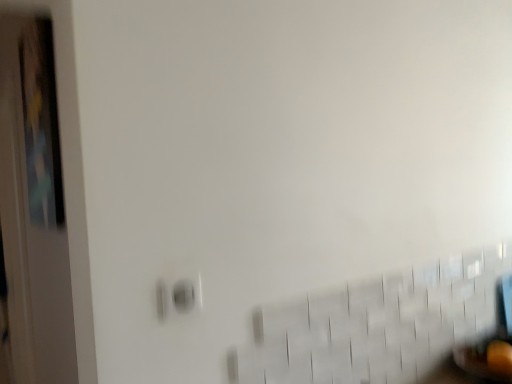
What do you see at coordinates (33, 211) in the screenshot? I see `wooden door at left` at bounding box center [33, 211].

Find the location of `wooden door at left`. wooden door at left is located at coordinates (33, 211).

The width and height of the screenshot is (512, 384). What do you see at coordinates (178, 297) in the screenshot?
I see `matte white electric outlet at lower left` at bounding box center [178, 297].

Where is `matte white electric outlet at lower left`? The image size is (512, 384). matte white electric outlet at lower left is located at coordinates (178, 297).

Locate an element on the screen. The width and height of the screenshot is (512, 384). wooden door at left is located at coordinates (33, 211).

Considering the positions of objects matte white electric outlet at lower left and wooden door at left in the image provided, who is more to the left, matte white electric outlet at lower left or wooden door at left?

wooden door at left is more to the left.

Considering their positions, is matte white electric outlet at lower left located in front of or behind wooden door at left?

In the image, matte white electric outlet at lower left appears in front of wooden door at left.

Considering the positions of points (161, 280) and (16, 366), is point (161, 280) farther from camera compared to point (16, 366)?

No, (161, 280) is in front of (16, 366).

From the image's perspective, is matte white electric outlet at lower left on top of wooden door at left?

Indeed, from the image's perspective, matte white electric outlet at lower left is shown above wooden door at left.

From a real-world perspective, which object rests below the other?

wooden door at left, from a real-world perspective.

In terms of width, does matte white electric outlet at lower left look wider or thinner when compared to wooden door at left?

In the image, matte white electric outlet at lower left appears to be more narrow than wooden door at left.

Consider the image. Does matte white electric outlet at lower left have a lesser height compared to wooden door at left?

Yes, matte white electric outlet at lower left is shorter than wooden door at left.

Who is bigger, matte white electric outlet at lower left or wooden door at left?

wooden door at left.

Is matte white electric outlet at lower left outside of wooden door at left?

That's correct, matte white electric outlet at lower left is outside of wooden door at left.

Are matte white electric outlet at lower left and wooden door at left far apart?

That's right, there is a large distance between matte white electric outlet at lower left and wooden door at left.

Is matte white electric outlet at lower left turned away from wooden door at left?

Yes, matte white electric outlet at lower left is positioned with its back facing wooden door at left.

Based on the photo, what's the angular difference between matte white electric outlet at lower left and wooden door at left's facing directions?

The angle between the facing direction of matte white electric outlet at lower left and the facing direction of wooden door at left is 90 degrees.

Measure the distance between matte white electric outlet at lower left and wooden door at left.

The distance of matte white electric outlet at lower left from wooden door at left is 1.09 meters.

At what (x,y) coordinates should I click in order to perform the action: click on door to the left of matte white electric outlet at lower left. Please return your answer as a coordinate pair (x, y). This screenshot has width=512, height=384. Looking at the image, I should click on pyautogui.click(x=33, y=211).

Considering the relative positions of wooden door at left and matte white electric outlet at lower left in the image provided, is wooden door at left to the left or to the right of matte white electric outlet at lower left?

Based on their positions, wooden door at left is located to the left of matte white electric outlet at lower left.

Considering their positions, is wooden door at left located in front of or behind matte white electric outlet at lower left?

Clearly, wooden door at left is behind matte white electric outlet at lower left.

Does point (11, 353) come closer to viewer compared to point (194, 299)?

No.

From the image's perspective, which is above, wooden door at left or matte white electric outlet at lower left?

matte white electric outlet at lower left is shown above in the image.

From a real-world perspective, which object stands above the other?

matte white electric outlet at lower left is physically above.

Which object is wider, wooden door at left or matte white electric outlet at lower left?

With larger width is wooden door at left.

Can you confirm if wooden door at left is taller than matte white electric outlet at lower left?

Yes.

Considering the sizes of objects wooden door at left and matte white electric outlet at lower left in the image provided, who is smaller, wooden door at left or matte white electric outlet at lower left?

Smaller between the two is matte white electric outlet at lower left.

Is wooden door at left not inside matte white electric outlet at lower left?

Yes, wooden door at left is outside of matte white electric outlet at lower left.

Is wooden door at left next to matte white electric outlet at lower left?

No, wooden door at left is not in contact with matte white electric outlet at lower left.

Is matte white electric outlet at lower left at the back of wooden door at left?

No.

What's the angular difference between wooden door at left and matte white electric outlet at lower left's facing directions?

90 degrees separate the facing orientations of wooden door at left and matte white electric outlet at lower left.

In the scene shown: How much distance is there between wooden door at left and matte white electric outlet at lower left?

1.09 meters.

This screenshot has height=384, width=512. Find the location of `door below the matte white electric outlet at lower left (from a real-world perspective)`. door below the matte white electric outlet at lower left (from a real-world perspective) is located at coordinates (33, 211).

Find the location of a particular element. door below the matte white electric outlet at lower left (from a real-world perspective) is located at coordinates pos(33,211).

Locate an element on the screen. The height and width of the screenshot is (384, 512). electric outlet that is above the wooden door at left (from a real-world perspective) is located at coordinates (178, 297).